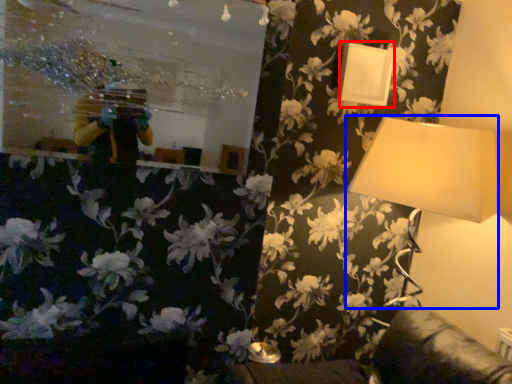
Question: Which object is further to the camera taking this photo, picture frame (highlighted by a red box) or lamp (highlighted by a blue box)?

Choices:
 (A) picture frame
 (B) lamp

Answer: (A)